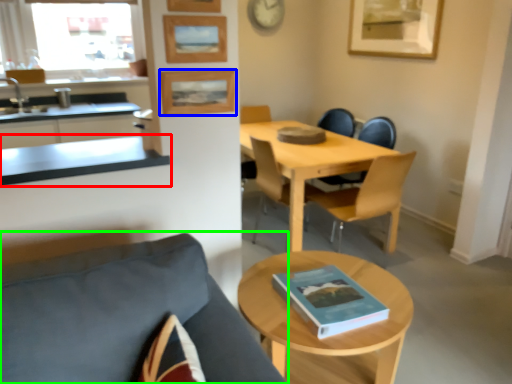
Question: Which is farther away from countertop (highlighted by a red box)? picture frame (highlighted by a blue box) or chair (highlighted by a green box)?

Choices:
 (A) picture frame
 (B) chair

Answer: (B)